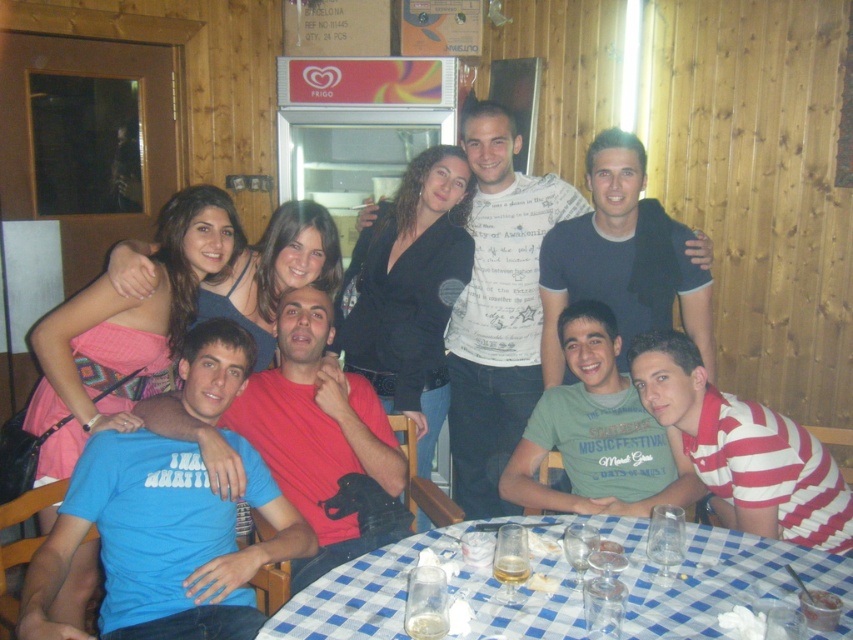
Question: Which object is the farthest from the green cotton shirt at lower center?

Choices:
 (A) dark blue t-shirt at center
 (B) white striped shirt at lower right
 (C) blue cotton shirt at center
 (D) blue t-shirt at center

Answer: (D)

Question: Does blue checkered tablecloth at lower center appear under blue cotton shirt at center?

Choices:
 (A) yes
 (B) no

Answer: (A)

Question: Among these points, which one is farthest from the camera?

Choices:
 (A) (466, 474)
 (B) (149, 593)
 (C) (625, 243)
 (D) (288, 474)

Answer: (A)

Question: Observing the image, what is the correct spatial positioning of white printed t-shirt at center in reference to white striped shirt at lower right?

Choices:
 (A) left
 (B) right

Answer: (A)

Question: Among these points, which one is farthest from the camera?

Choices:
 (A) (163, 417)
 (B) (94, 522)
 (C) (604, 384)
 (D) (729, 490)

Answer: (C)

Question: Can you confirm if blue checkered tablecloth at lower center is bigger than blue cotton shirt at center?

Choices:
 (A) no
 (B) yes

Answer: (A)